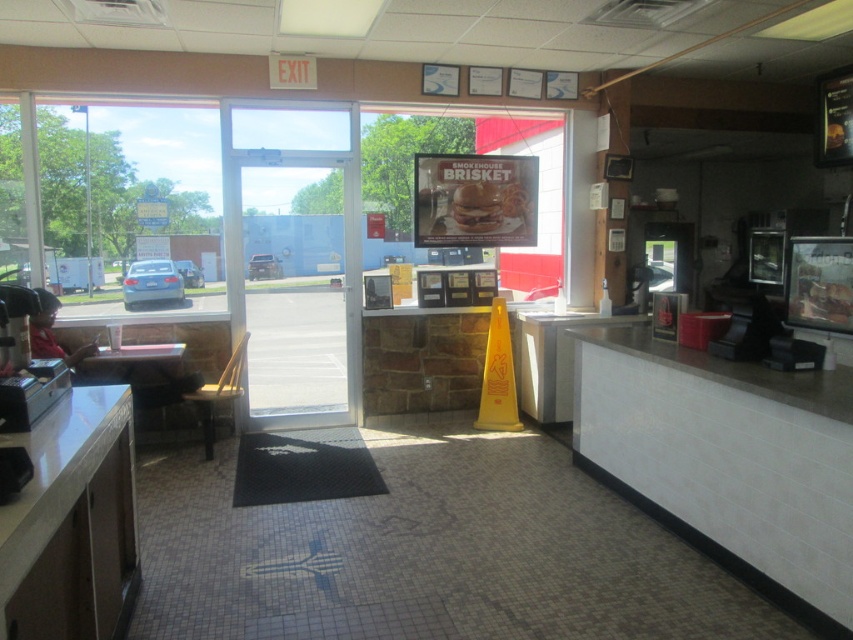
How distant is transparent glass door at center from transparent glass window at left?

transparent glass door at center is 64.25 centimeters away from transparent glass window at left.

Is transparent glass door at center smaller than transparent glass window at left?

Actually, transparent glass door at center might be larger than transparent glass window at left.

Image resolution: width=853 pixels, height=640 pixels. Identify the location of transparent glass door at center. (294, 259).

Who is shorter, transparent glass window at left or black rubber mat at center?

With less height is black rubber mat at center.

Is transparent glass window at left behind black rubber mat at center?

Yes.

You are a GUI agent. You are given a task and a screenshot of the screen. Output one action in this format:
    pyautogui.click(x=<x>, y=<y>)
    Task: Click on the transparent glass window at left
    
    Given the screenshot: What is the action you would take?
    pyautogui.click(x=131, y=204)

Is transparent glass window at left positioned at the back of golden brown bread at center?

That is False.

Is transparent glass window at left shorter than golden brown bread at center?

Incorrect, transparent glass window at left's height does not fall short of golden brown bread at center's.

Describe the element at coordinates (131, 204) in the screenshot. I see `transparent glass window at left` at that location.

The image size is (853, 640). Find the location of `transparent glass window at left`. transparent glass window at left is located at coordinates (131, 204).